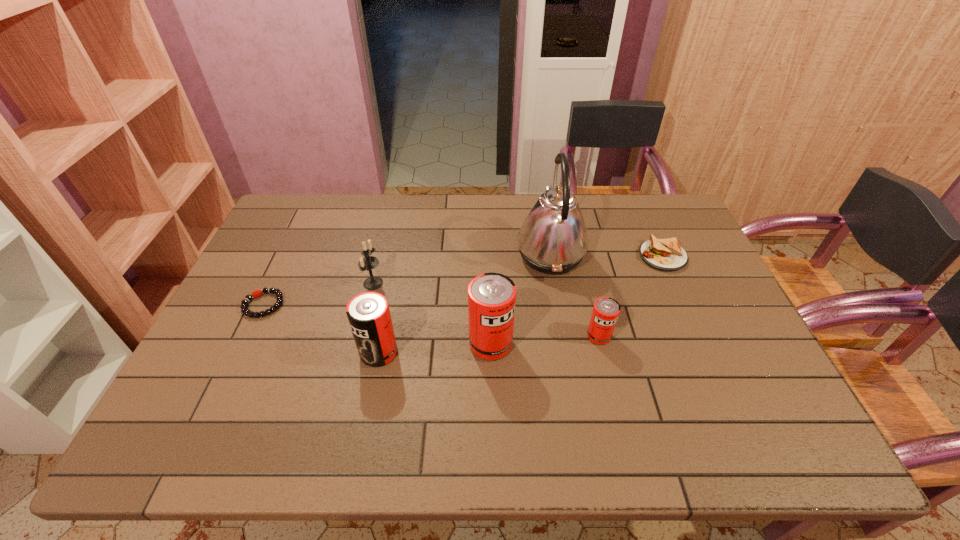
I want to click on the second tallest can, so click(x=368, y=313).

Locate an element on the screen. The image size is (960, 540). the fourth object from left to right is located at coordinates (491, 296).

Find the location of `the rightmost can`. the rightmost can is located at coordinates (606, 310).

Identify the location of the shortest can. (606, 310).

The image size is (960, 540). Find the location of `the tallest object`. the tallest object is located at coordinates pyautogui.click(x=553, y=239).

This screenshot has height=540, width=960. In order to click on the shortest object in this screenshot , I will do `click(257, 293)`.

Locate an element on the screen. the leftmost object is located at coordinates (257, 293).

You are a GUI agent. You are given a task and a screenshot of the screen. Output one action in this format:
    pyautogui.click(x=<x>, y=<y>)
    Task: Click on the rightmost object
    This screenshot has width=960, height=540.
    Given the screenshot: What is the action you would take?
    pyautogui.click(x=666, y=254)

This screenshot has width=960, height=540. I want to click on the sixth tallest object, so tap(666, 254).

What are the coordinates of `candle holder` in the screenshot? It's located at pos(368,262).